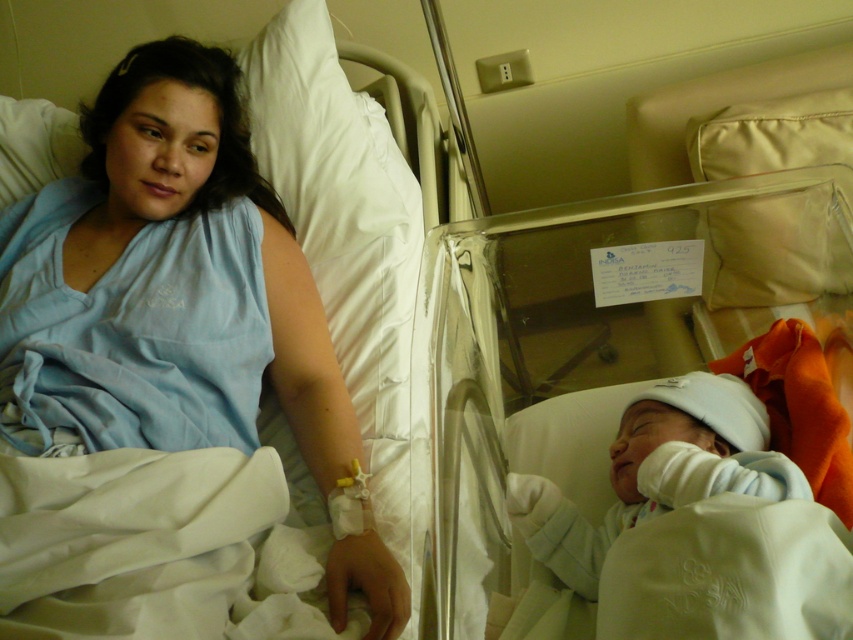
Question: Which point is closer to the camera?

Choices:
 (A) blue fabric at upper left
 (B) white soft newborn at center

Answer: (B)

Question: Does blue fabric at upper left have a smaller size compared to white soft newborn at center?

Choices:
 (A) yes
 (B) no

Answer: (B)

Question: Is blue fabric at upper left to the left of white soft newborn at center from the viewer's perspective?

Choices:
 (A) yes
 (B) no

Answer: (A)

Question: Does blue fabric at upper left appear under white soft newborn at center?

Choices:
 (A) yes
 (B) no

Answer: (B)

Question: Which of the following is the closest to the observer?

Choices:
 (A) (665, 493)
 (B) (144, 48)

Answer: (A)